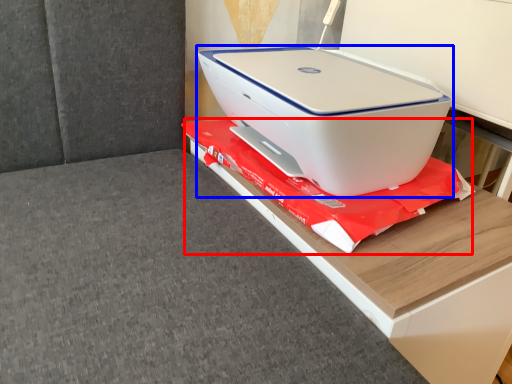
Question: Which of the following is the closest to the observer, material (highlighted by a red box) or printer (highlighted by a blue box)?

Choices:
 (A) material
 (B) printer

Answer: (B)